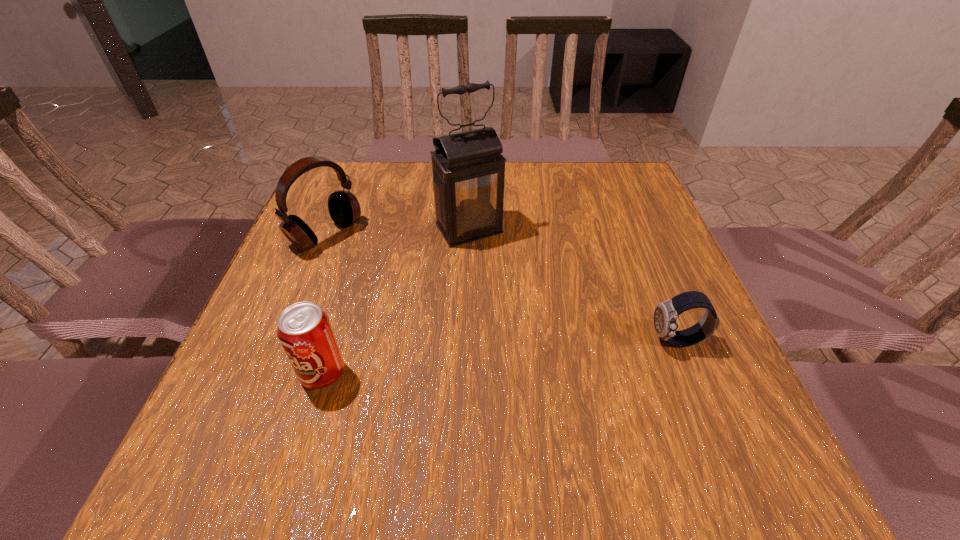
Identify the location of free spot located 0.130m on the front-facing side of the tallest object. This screenshot has width=960, height=540. (507, 282).

This screenshot has width=960, height=540. I want to click on free space located on the front-facing side of the tallest object, so click(562, 363).

Locate an element on the screen. This screenshot has width=960, height=540. free region located on the front-facing side of the tallest object is located at coordinates (528, 314).

I want to click on vacant region located on the ear pads of the headset, so click(x=367, y=264).

I want to click on vacant space located on the ear pads of the headset, so click(x=372, y=268).

Locate an element on the screen. vacant space located on the ear pads of the headset is located at coordinates click(467, 331).

Identify the location of object positioned at the near edge. (304, 330).

In order to click on soda that is at the left edge in this screenshot , I will do `click(304, 330)`.

Where is `headset that is at the left edge`? The height and width of the screenshot is (540, 960). headset that is at the left edge is located at coordinates (344, 208).

The height and width of the screenshot is (540, 960). What are the coordinates of `object at the right edge` in the screenshot? It's located at (666, 313).